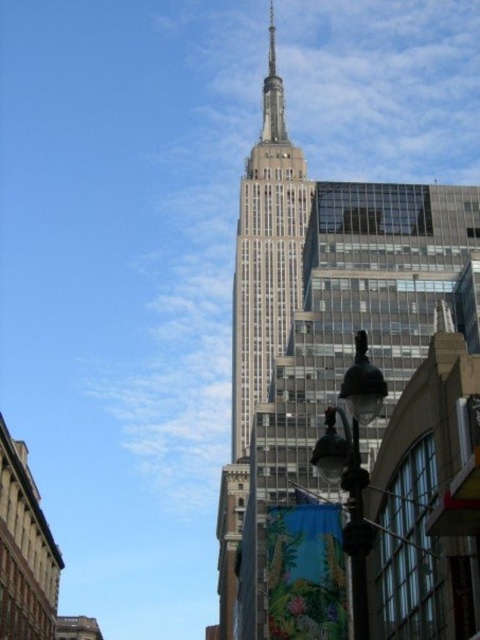
You are a tourist standing on the sidewalk in front of the Empire State Building. You want to take a photo that includes both the white glass skyscraper at center and the polished steel spire at center. Which object should you frame first in your camera to ensure both are visible in the photo?

Since the white glass skyscraper at center is larger in size than the polished steel spire at center, you should frame the larger white glass skyscraper at center first in your camera to ensure both are visible in the photo.

You are standing at the Empire State Building and looking at the point marked as coordinates (324, 332). What structure is located at this point?

The white glass skyscraper at center is located at point (324, 332).